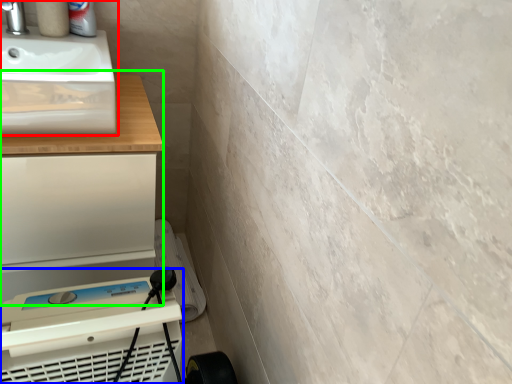
Question: Which is nearer to the sink (highlighted by a red box)? appliance (highlighted by a blue box) or counter (highlighted by a green box).

Choices:
 (A) appliance
 (B) counter

Answer: (B)